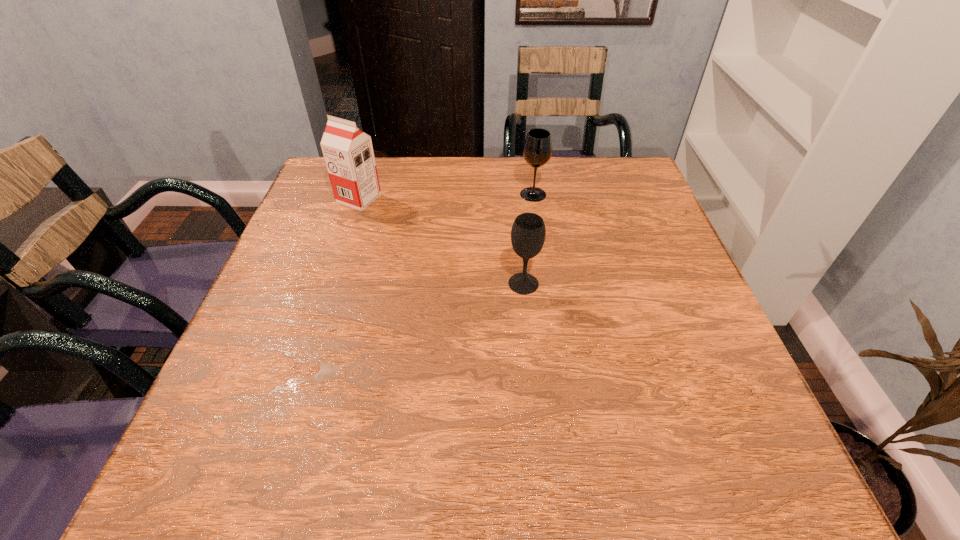
I want to click on empty space that is in between the leftmost object and the nearest object, so click(442, 241).

Find the location of a particular element. unoccupied area between the nearest object and the tallest object is located at coordinates (442, 241).

The height and width of the screenshot is (540, 960). Find the location of `free space between the nearest object and the soya milk`. free space between the nearest object and the soya milk is located at coordinates (442, 241).

The height and width of the screenshot is (540, 960). Identify the location of free space between the leftmost object and the farther wineglass. (446, 197).

Locate which object ranks in proximity to the farther wineglass. Please provide its 2D coordinates. Your answer should be formatted as a tuple, i.e. [(x, y)], where the tuple contains the x and y coordinates of a point satisfying the conditions above.

[(528, 232)]

Identify the location of object that is the closest to the tallest object. This screenshot has width=960, height=540. (537, 150).

Locate an element on the screen. vacant space that satisfies the following two spatial constraints: 1. on the back side of the farther wineglass; 2. on the right side of the nearest object is located at coordinates coord(515,194).

The height and width of the screenshot is (540, 960). I want to click on free space in the image that satisfies the following two spatial constraints: 1. on the back side of the farther wineglass; 2. on the right side of the leftmost object, so [360, 194].

This screenshot has height=540, width=960. In order to click on vacant space that satisfies the following two spatial constraints: 1. on the back side of the farther wineglass; 2. on the right side of the tallest object in this screenshot , I will do `click(360, 194)`.